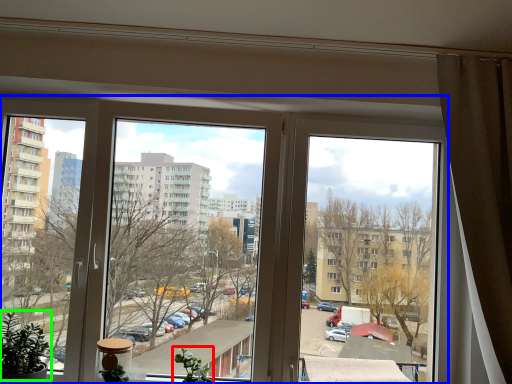
Question: Which is farther away from plant (highlighted by a red box)? window (highlighted by a blue box) or plant (highlighted by a green box)?

Choices:
 (A) window
 (B) plant

Answer: (A)